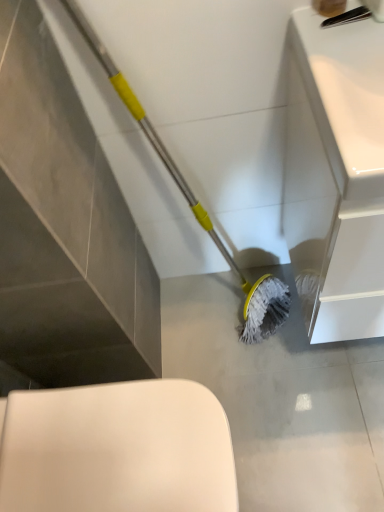
Question: Does white glossy sink at upper right have a smaller size compared to gray matte mop head at lower center?

Choices:
 (A) yes
 (B) no

Answer: (B)

Question: From a real-world perspective, is white glossy sink at upper right beneath gray matte mop head at lower center?

Choices:
 (A) no
 (B) yes

Answer: (A)

Question: Is white glossy sink at upper right outside of gray matte mop head at lower center?

Choices:
 (A) yes
 (B) no

Answer: (A)

Question: Could you tell me if white glossy sink at upper right is facing gray matte mop head at lower center?

Choices:
 (A) yes
 (B) no

Answer: (B)

Question: Is white glossy sink at upper right next to gray matte mop head at lower center?

Choices:
 (A) no
 (B) yes

Answer: (A)

Question: Is white glossy sink at upper right at the left side of gray matte mop head at lower center?

Choices:
 (A) yes
 (B) no

Answer: (B)

Question: From the image's perspective, is white glossy sink at upper right above white glossy toilet at lower left?

Choices:
 (A) yes
 (B) no

Answer: (A)

Question: Does white glossy sink at upper right have a greater width compared to white glossy toilet at lower left?

Choices:
 (A) yes
 (B) no

Answer: (B)

Question: Could you tell me if white glossy sink at upper right is facing white glossy toilet at lower left?

Choices:
 (A) yes
 (B) no

Answer: (B)

Question: Does white glossy sink at upper right have a larger size compared to white glossy toilet at lower left?

Choices:
 (A) yes
 (B) no

Answer: (A)

Question: From the image's perspective, is white glossy sink at upper right under white glossy toilet at lower left?

Choices:
 (A) yes
 (B) no

Answer: (B)

Question: Could white glossy toilet at lower left be considered to be inside white glossy sink at upper right?

Choices:
 (A) no
 (B) yes

Answer: (A)

Question: Is white glossy toilet at lower left facing towards gray matte mop head at lower center?

Choices:
 (A) no
 (B) yes

Answer: (A)